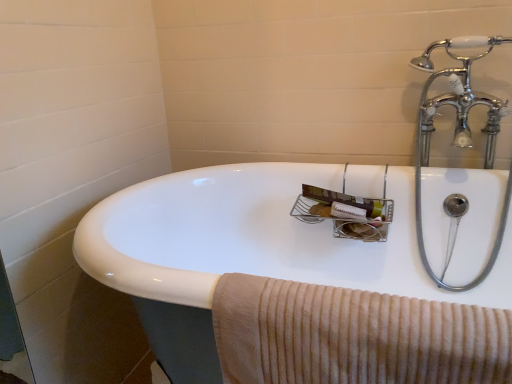
What do you see at coordinates (257, 238) in the screenshot? The image size is (512, 384). I see `white glossy sink at center` at bounding box center [257, 238].

Locate an element on the screen. Image resolution: width=512 pixels, height=384 pixels. white glossy sink at center is located at coordinates (257, 238).

Locate an element on the screen. beige corduroy towel at lower right is located at coordinates pos(353,336).

What do you see at coordinates (353, 336) in the screenshot? I see `beige corduroy towel at lower right` at bounding box center [353, 336].

Identify the location of white glossy sink at center. This screenshot has width=512, height=384. (257, 238).

Is beige corduroy towel at lower right to the left of white glossy sink at center from the viewer's perspective?

Yes.

Which object is more forward, beige corduroy towel at lower right or white glossy sink at center?

white glossy sink at center.

Is point (302, 289) in front of point (277, 173)?

Yes, it is in front of point (277, 173).

Looking at this image, from the image's perspective, is beige corduroy towel at lower right positioned above or below white glossy sink at center?

From the image's perspective, beige corduroy towel at lower right appears above white glossy sink at center.

From a real-world perspective, between beige corduroy towel at lower right and white glossy sink at center, who is vertically lower?

From a 3D spatial view, white glossy sink at center is below.

In terms of width, does beige corduroy towel at lower right look wider or thinner when compared to white glossy sink at center?

In the image, beige corduroy towel at lower right appears to be more narrow than white glossy sink at center.

Considering the sizes of beige corduroy towel at lower right and white glossy sink at center in the image, is beige corduroy towel at lower right taller or shorter than white glossy sink at center?

Clearly, beige corduroy towel at lower right is shorter compared to white glossy sink at center.

Considering the sizes of objects beige corduroy towel at lower right and white glossy sink at center in the image provided, who is bigger, beige corduroy towel at lower right or white glossy sink at center?

Bigger between the two is white glossy sink at center.

In the scene shown: Does beige corduroy towel at lower right contain white glossy sink at center?

No, white glossy sink at center is located outside of beige corduroy towel at lower right.

In the scene shown: Is beige corduroy towel at lower right beside white glossy sink at center?

There is a gap between beige corduroy towel at lower right and white glossy sink at center.

Is beige corduroy towel at lower right positioned with its back to white glossy sink at center?

Yes, beige corduroy towel at lower right is facing away from white glossy sink at center.

What's the angular difference between beige corduroy towel at lower right and white glossy sink at center's facing directions?

1.79 degrees separate the facing orientations of beige corduroy towel at lower right and white glossy sink at center.

The width and height of the screenshot is (512, 384). I want to click on bath towel that is on the left side of white glossy sink at center, so click(353, 336).

Is white glossy sink at center to the left of beige corduroy towel at lower right from the viewer's perspective?

No, white glossy sink at center is not to the left of beige corduroy towel at lower right.

Is white glossy sink at center further to camera compared to beige corduroy towel at lower right?

That is False.

Which is in front, point (205, 251) or point (500, 379)?

Point (500, 379)

From the image's perspective, between white glossy sink at center and beige corduroy towel at lower right, which one is located above?

beige corduroy towel at lower right.

From a real-world perspective, who is located higher, white glossy sink at center or beige corduroy towel at lower right?

beige corduroy towel at lower right.

Can you confirm if white glossy sink at center is thinner than beige corduroy towel at lower right?

No, white glossy sink at center is not thinner than beige corduroy towel at lower right.

Considering the sizes of objects white glossy sink at center and beige corduroy towel at lower right in the image provided, who is taller, white glossy sink at center or beige corduroy towel at lower right?

white glossy sink at center.

Considering the relative sizes of white glossy sink at center and beige corduroy towel at lower right in the image provided, is white glossy sink at center smaller than beige corduroy towel at lower right?

Actually, white glossy sink at center might be larger than beige corduroy towel at lower right.

Is white glossy sink at center outside of beige corduroy towel at lower right?

Yes.

Is white glossy sink at center far from beige corduroy towel at lower right?

No, there isn't a large distance between white glossy sink at center and beige corduroy towel at lower right.

Is beige corduroy towel at lower right at the back of white glossy sink at center?

No, white glossy sink at center is not facing away from beige corduroy towel at lower right.

Locate an element on the screen. bath towel above the white glossy sink at center (from the image's perspective) is located at coordinates (353, 336).

The image size is (512, 384). Find the location of `sink on the right of the beige corduroy towel at lower right`. sink on the right of the beige corduroy towel at lower right is located at coordinates (257, 238).

This screenshot has width=512, height=384. What are the coordinates of `bath towel behind the white glossy sink at center` in the screenshot? It's located at (353, 336).